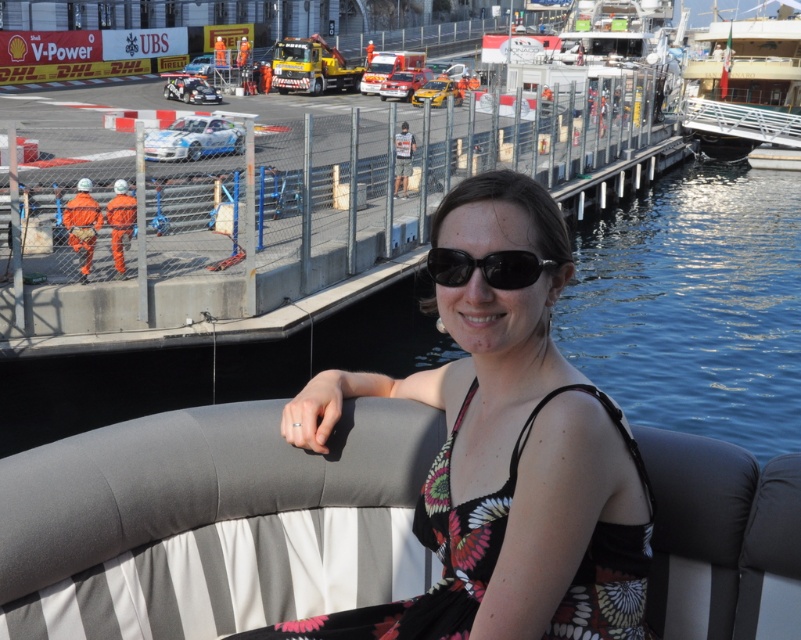
In the scene shown: Is black floral dress at center smaller than white plastic boat at upper center?

Yes.

The image size is (801, 640). I want to click on black floral dress at center, so click(502, 456).

Where is `black floral dress at center`? The image size is (801, 640). black floral dress at center is located at coordinates (502, 456).

Between black floral dress at center and white glossy yacht at upper right, which one appears on the right side from the viewer's perspective?

Positioned to the right is white glossy yacht at upper right.

Is black floral dress at center positioned before white glossy yacht at upper right?

That is True.

The width and height of the screenshot is (801, 640). Describe the element at coordinates (502, 456) in the screenshot. I see `black floral dress at center` at that location.

At what (x,y) coordinates should I click in order to perform the action: click on black floral dress at center. Please return your answer as a coordinate pair (x, y). The height and width of the screenshot is (640, 801). Looking at the image, I should click on (502, 456).

Based on the photo, does white glossy yacht at upper right have a lesser height compared to white plastic boat at upper center?

In fact, white glossy yacht at upper right may be taller than white plastic boat at upper center.

Is white glossy yacht at upper right bigger than white plastic boat at upper center?

Yes.

Locate an element on the screen. white glossy yacht at upper right is located at coordinates (749, 64).

Image resolution: width=801 pixels, height=640 pixels. I want to click on white glossy yacht at upper right, so click(749, 64).